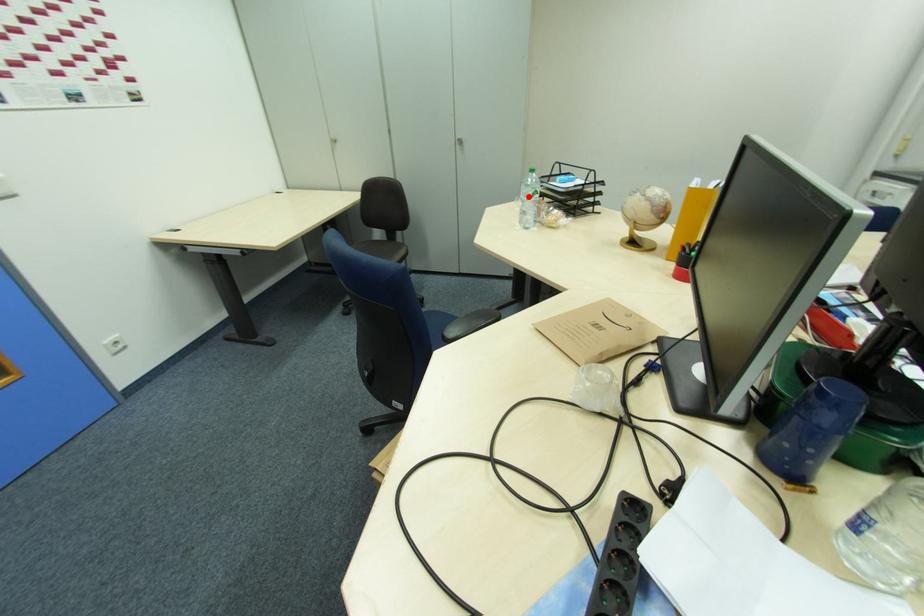
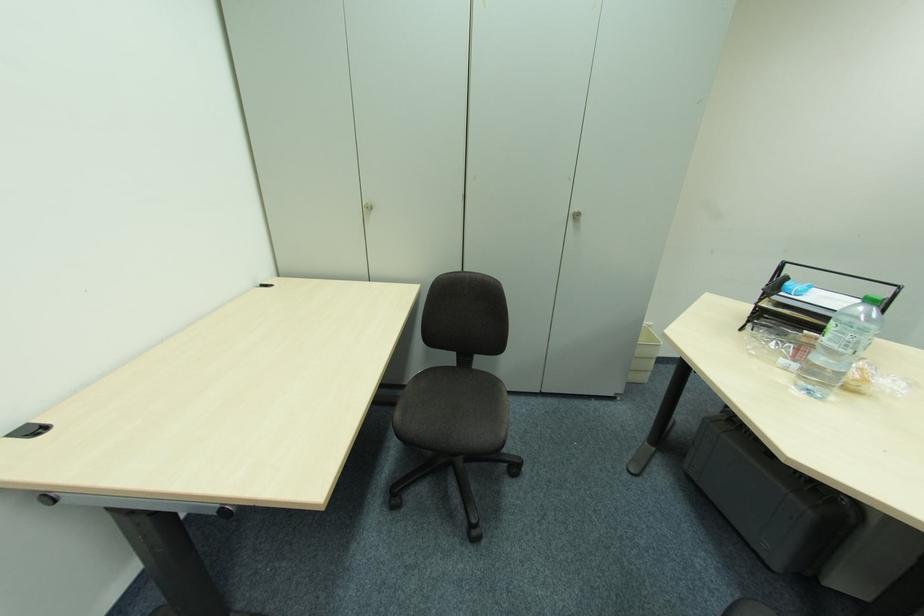
Question: I am providing you with two images of the same scene from different viewpoints. A red point is shown in image1. For the corresponding object point in image2, is it positioned nearer or farther from the camera?

Choices:
 (A) Nearer
 (B) Farther

Answer: (B)